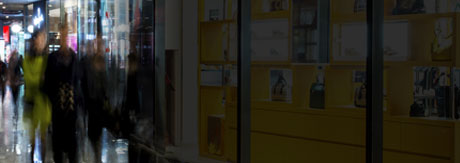
You are a GUI agent. You are given a task and a screenshot of the screen. Output one action in this format:
    pyautogui.click(x=<x>, y=<y>)
    Task: Click on the lighted sign
    This screenshot has width=460, height=163.
    Given the screenshot: What is the action you would take?
    pyautogui.click(x=40, y=21), pyautogui.click(x=13, y=29)